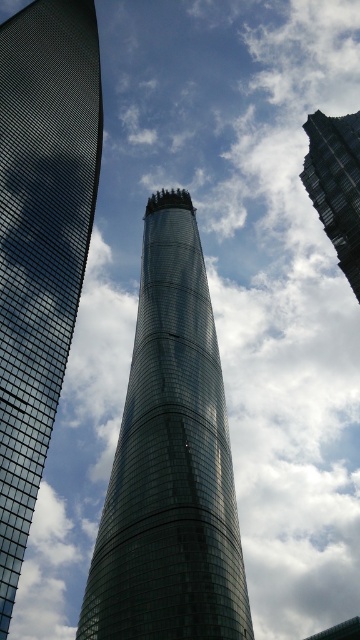
You are a drone operator flying a drone that can only ascend or descend vertically. You need to capture a photo of both the shiny glass skyscraper at left and the glassy skyscraper at upper right. Which skyscraper should you position your drone below to ensure both are in frame?

You should position your drone below the shiny glass skyscraper at left because it is above the glassy skyscraper at upper right, so placing the drone below it will allow both to be visible in the frame.

You are an architect planning to install a new light fixture between the shiny glass tower at center and the shiny glass skyscraper at left. Based on their positions, which building should the light fixture be closer to?

The shiny glass tower at center is positioned under the shiny glass skyscraper at left, so the light fixture should be closer to the shiny glass skyscraper at left to ensure proper illumination and alignment with the structure above.

From the picture: You are an architect planning to install solar panels on both the shiny glass tower at center and the glassy skyscraper at upper right. Which building requires more solar panels to cover the same proportion of its facade?

The shiny glass tower at center requires more solar panels because it is bigger than the glassy skyscraper at upper right, so covering the same proportion would need a larger number of panels.